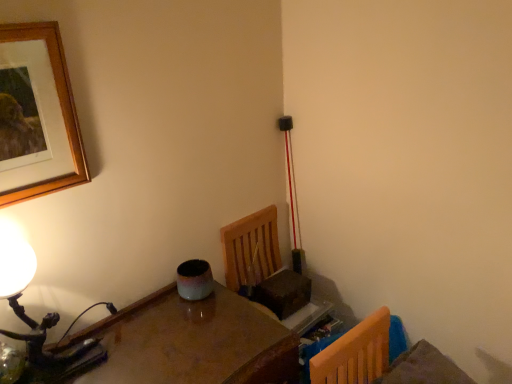
Question: Is wooden picture frame at upper left next to glossy wooden table at lower left and touching it?

Choices:
 (A) no
 (B) yes

Answer: (A)

Question: Is glossy wooden table at lower left inside wooden picture frame at upper left?

Choices:
 (A) no
 (B) yes

Answer: (A)

Question: Can you confirm if wooden picture frame at upper left is wider than glossy wooden table at lower left?

Choices:
 (A) yes
 (B) no

Answer: (B)

Question: Does wooden picture frame at upper left have a lesser width compared to glossy wooden table at lower left?

Choices:
 (A) yes
 (B) no

Answer: (A)

Question: Is wooden picture frame at upper left far from glossy wooden table at lower left?

Choices:
 (A) yes
 (B) no

Answer: (B)

Question: Is the depth of wooden picture frame at upper left less than that of glossy wooden table at lower left?

Choices:
 (A) no
 (B) yes

Answer: (A)

Question: Does wooden picture frame at upper left lie behind matte black table lamp at left?

Choices:
 (A) yes
 (B) no

Answer: (B)

Question: Considering the relative sizes of wooden picture frame at upper left and matte black table lamp at left in the image provided, is wooden picture frame at upper left bigger than matte black table lamp at left?

Choices:
 (A) no
 (B) yes

Answer: (A)

Question: Would you say matte black table lamp at left is part of wooden picture frame at upper left's contents?

Choices:
 (A) no
 (B) yes

Answer: (A)

Question: Is the depth of wooden picture frame at upper left less than that of matte black table lamp at left?

Choices:
 (A) yes
 (B) no

Answer: (A)

Question: Is wooden picture frame at upper left thinner than matte black table lamp at left?

Choices:
 (A) yes
 (B) no

Answer: (A)

Question: Is wooden picture frame at upper left far from matte black table lamp at left?

Choices:
 (A) yes
 (B) no

Answer: (B)

Question: Can you confirm if glossy wooden table at lower left is positioned to the left of wooden picture frame at upper left?

Choices:
 (A) no
 (B) yes

Answer: (A)